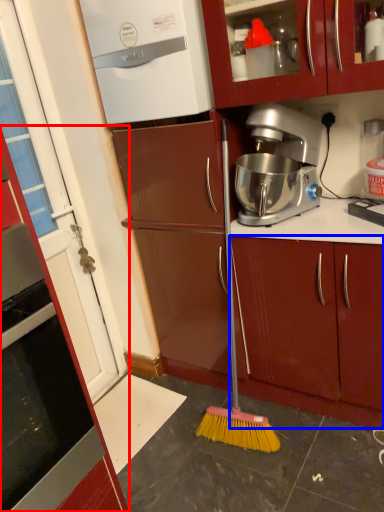
Question: Which point is closer to the camera, cabinetry (highlighted by a red box) or cabinetry (highlighted by a blue box)?

Choices:
 (A) cabinetry
 (B) cabinetry

Answer: (A)